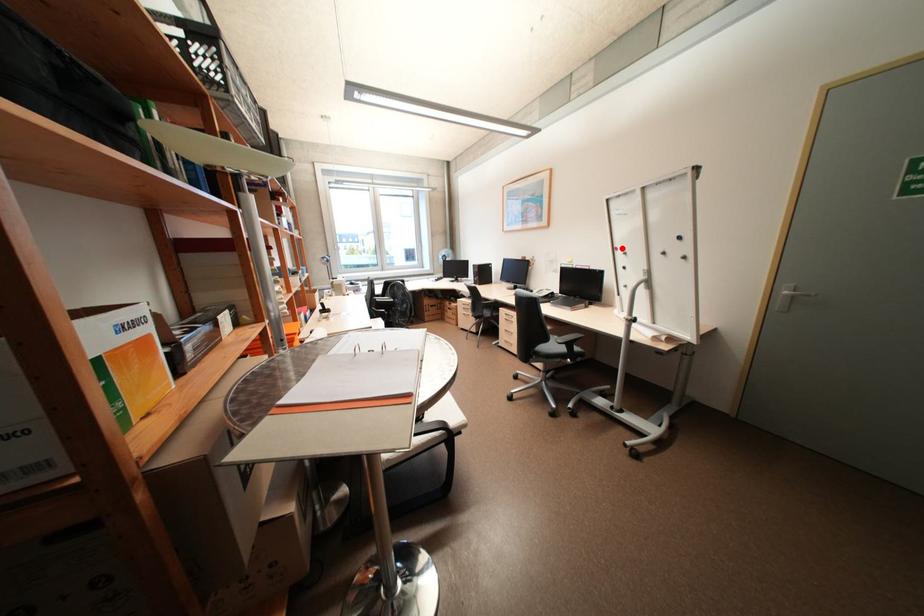
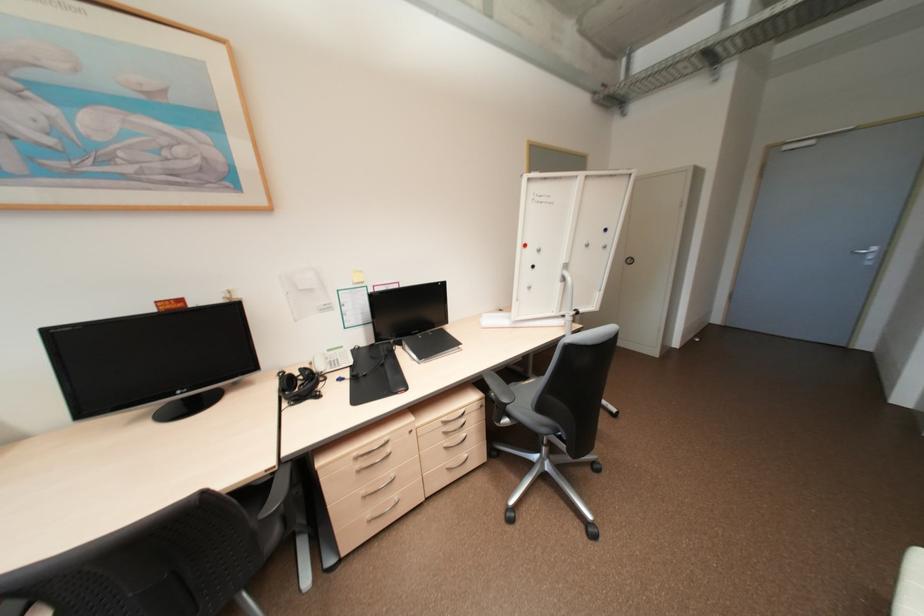
Locate, in the second image, the point that corresponds to the highlighted location in the first image.

(530, 245)